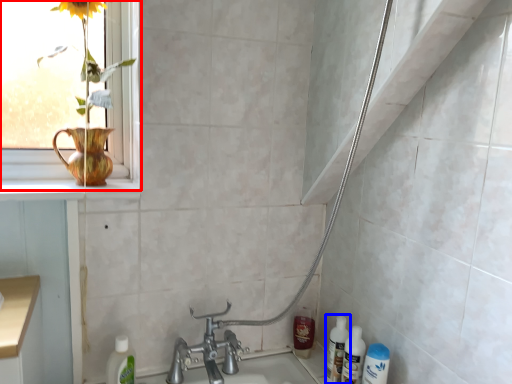
Question: Which object is further to the camera taking this photo, window (highlighted by a red box) or bottle (highlighted by a blue box)?

Choices:
 (A) window
 (B) bottle

Answer: (B)